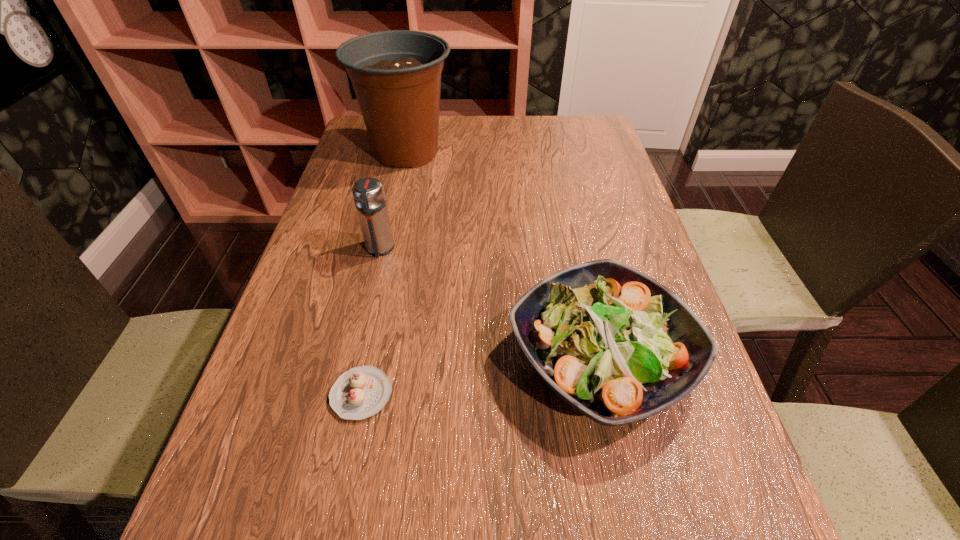
Locate an element on the screen. This screenshot has height=540, width=960. vacant space at the far left corner is located at coordinates (360, 130).

Locate an element on the screen. free region at the far right corner is located at coordinates (578, 146).

The image size is (960, 540). In order to click on free space between the third shortest object and the tallest object in this screenshot , I will do `click(393, 201)`.

Find the location of a particular element. free space between the salad plate and the tallest object is located at coordinates (503, 256).

You are a GUI agent. You are given a task and a screenshot of the screen. Output one action in this format:
    pyautogui.click(x=<x>, y=<y>)
    Task: Click on the empty location between the second tallest object and the shortest object
    
    Given the screenshot: What is the action you would take?
    pyautogui.click(x=371, y=321)

The width and height of the screenshot is (960, 540). Find the location of `vacant area between the shortest object and the third shortest object`. vacant area between the shortest object and the third shortest object is located at coordinates (371, 321).

Locate an element on the screen. The width and height of the screenshot is (960, 540). empty location between the thermos bottle and the rightmost object is located at coordinates (490, 305).

This screenshot has width=960, height=540. Identify the location of free area in between the tallest object and the shortest object. (384, 273).

Find the location of `free space between the rightmost object and the flowerpot`. free space between the rightmost object and the flowerpot is located at coordinates (503, 256).

Locate an element on the screen. The width and height of the screenshot is (960, 540). vacant area between the farthest object and the rightmost object is located at coordinates (503, 256).